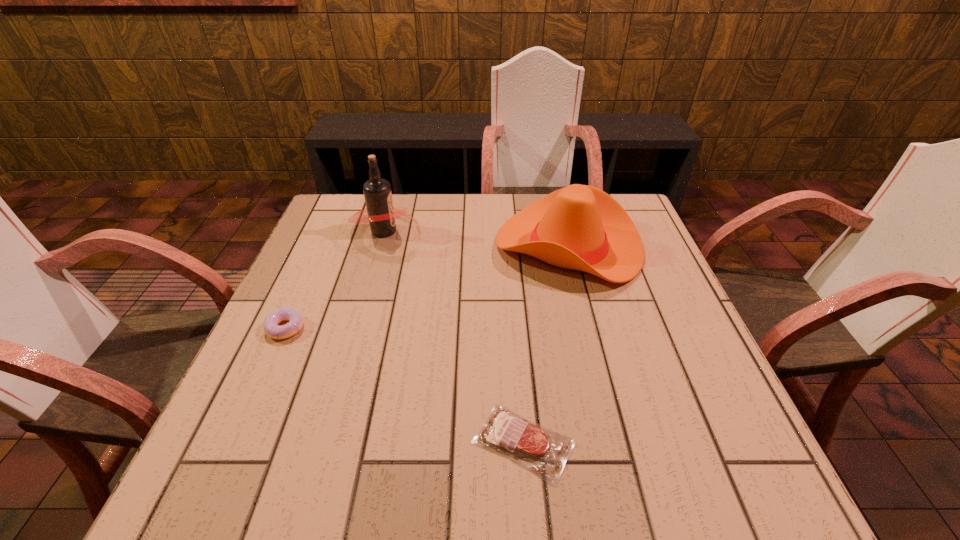
I want to click on free space that satisfies the following two spatial constraints: 1. on the label of the root beer; 2. on the back side of the cowboy hat, so click(x=381, y=246).